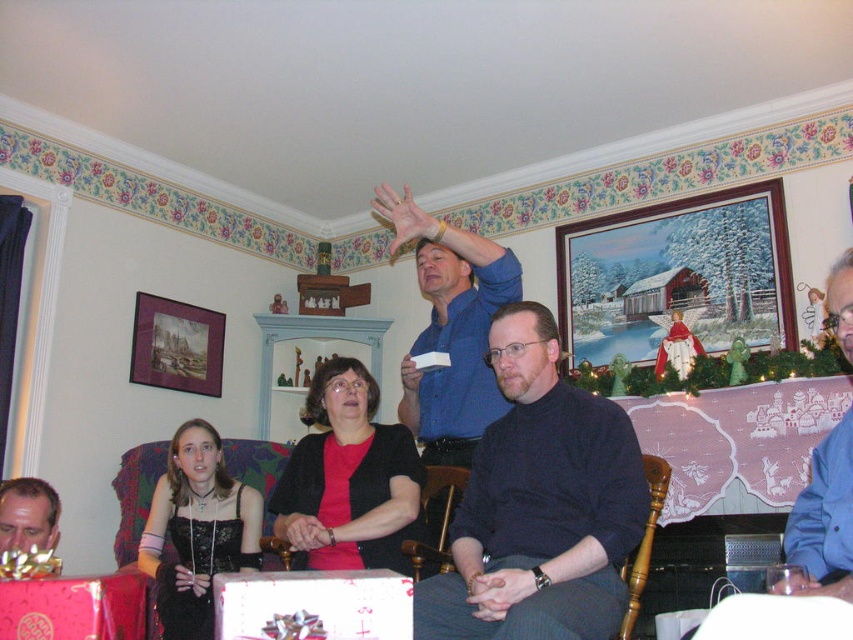
You are at a family gathering and see a man in a blue shirt standing at the center of the room. There is a black matte shirt at center located at point (538, 506). What is the man wearing on his upper body?

The man is wearing a blue shirt, but there is also a black matte shirt at center located at point (538, 506). However, the description specifies that the black matte shirt is at that point, so the man is actually wearing the black matte shirt at center.

You are standing in the room and want to find the black matte shirt at center. According to the coordinates provided, where should you look?

The black matte shirt at center is located at point (538, 506), so you should look there.